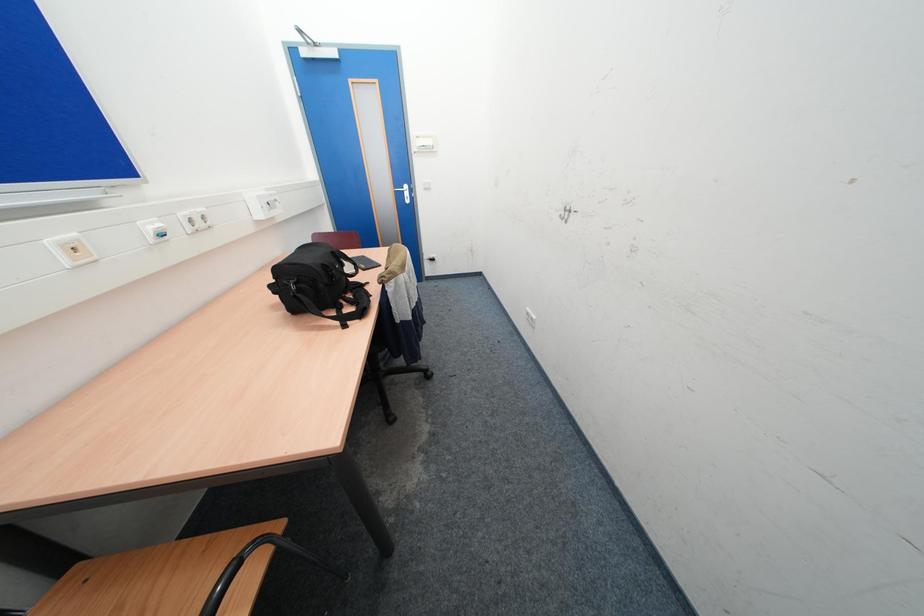
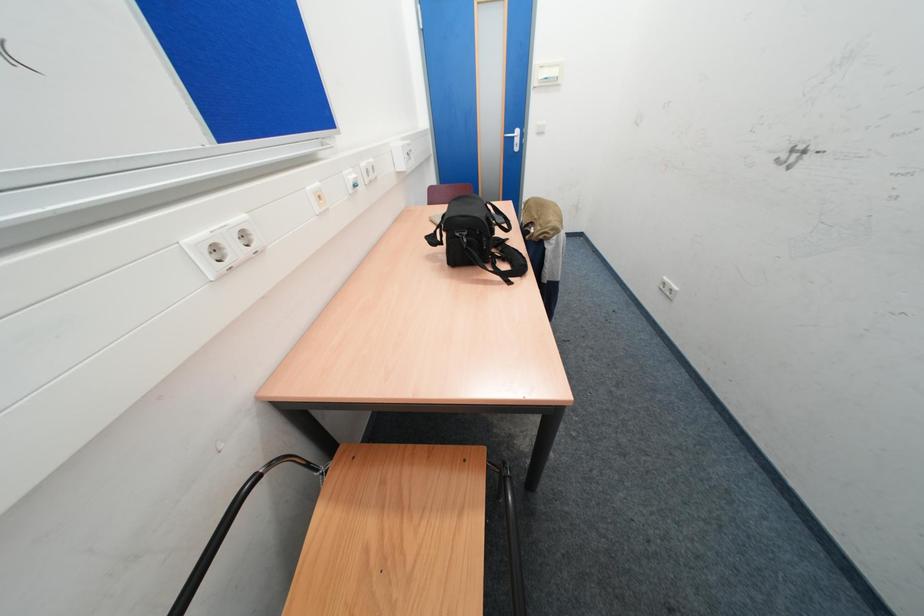
Question: In a continuous first-person perspective shot, in which direction is the camera moving?

Choices:
 (A) Left
 (B) Right
 (C) Forward
 (D) Backward

Answer: (A)